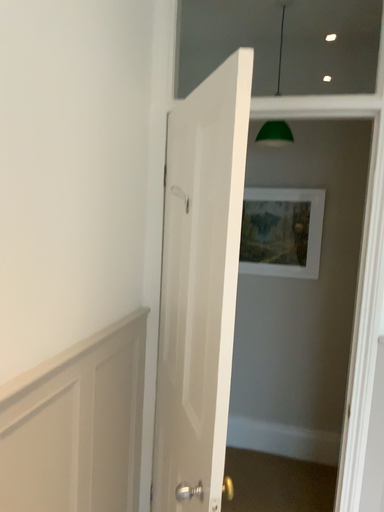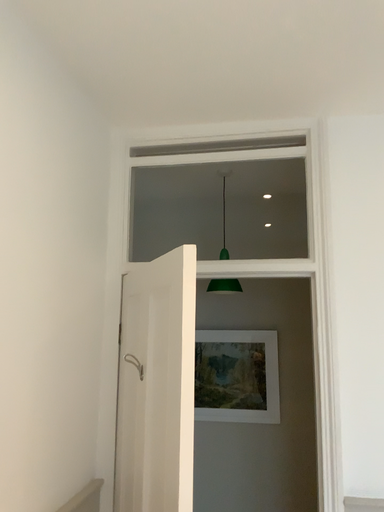
Question: Which way did the camera rotate in the video?

Choices:
 (A) rotated upward
 (B) rotated downward

Answer: (A)